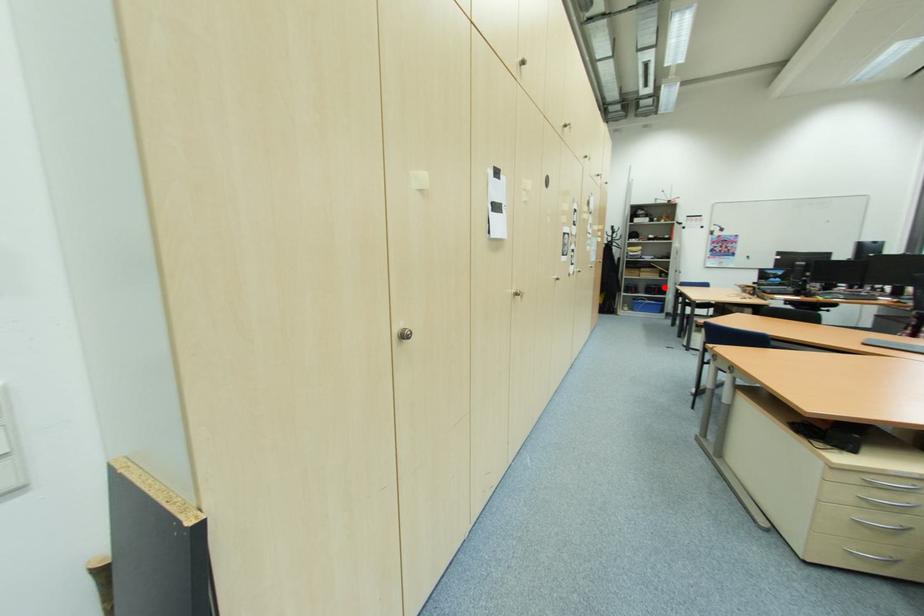
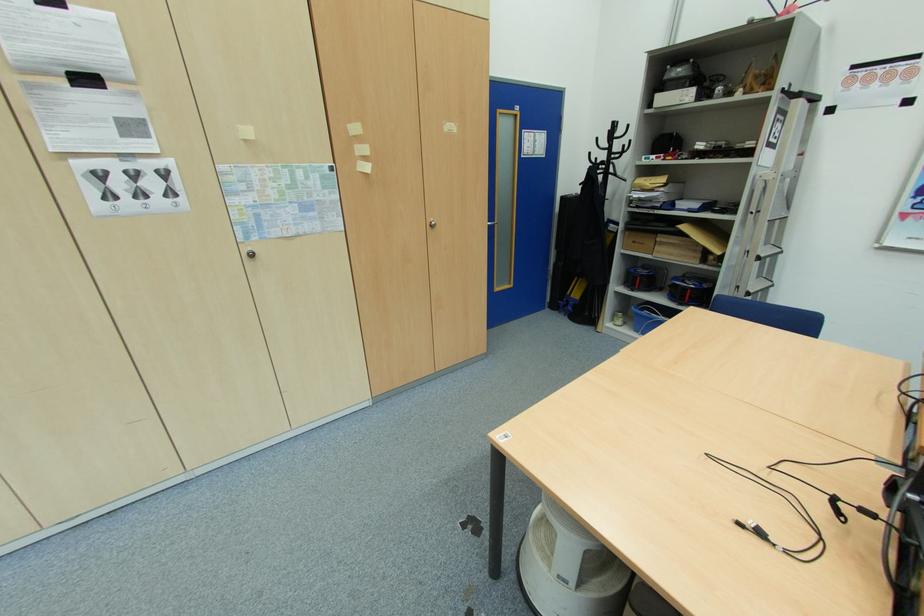
Find the pixel in the second image that matches the highlighted location in the first image.

(709, 286)